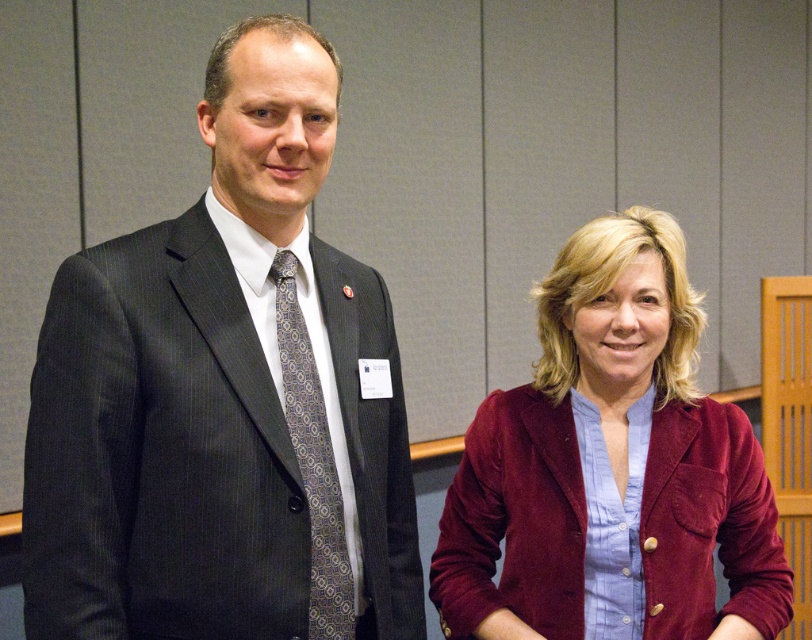
Question: Where is matte black suit at left located in relation to patterned silk tie at center in the image?

Choices:
 (A) below
 (B) above

Answer: (B)

Question: Does matte black suit at left appear over velvet maroon blazer at lower right?

Choices:
 (A) no
 (B) yes

Answer: (B)

Question: Does matte black suit at left appear over patterned silk tie at center?

Choices:
 (A) yes
 (B) no

Answer: (A)

Question: Which of these objects is positioned farthest from the matte black suit at left?

Choices:
 (A) patterned silk tie at center
 (B) velvet maroon blazer at lower right

Answer: (B)

Question: Which object is the farthest from the velvet maroon blazer at lower right?

Choices:
 (A) patterned silk tie at center
 (B) matte black suit at left

Answer: (A)

Question: Which point appears farthest from the camera in this image?

Choices:
 (A) (506, 611)
 (B) (154, 275)
 (C) (290, 317)

Answer: (A)